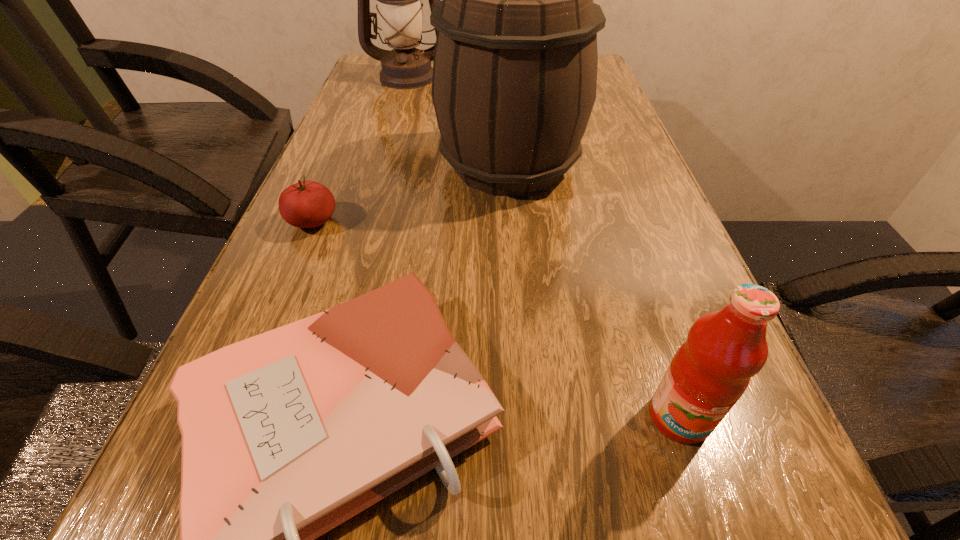
Find the location of a particular element. Image resolution: width=960 pixels, height=540 pixels. tomato that is at the left edge is located at coordinates (306, 204).

Image resolution: width=960 pixels, height=540 pixels. Identify the location of wine bucket present at the right edge. (514, 82).

The width and height of the screenshot is (960, 540). Find the location of `fruit juice that is at the right edge`. fruit juice that is at the right edge is located at coordinates tap(709, 373).

Locate an element on the screen. This screenshot has height=540, width=960. object that is at the far left corner is located at coordinates (399, 8).

In order to click on vacant space at the left edge of the desktop in this screenshot , I will do pos(334,141).

Locate an element on the screen. This screenshot has height=540, width=960. free space at the right edge of the desktop is located at coordinates (738, 450).

The image size is (960, 540). In order to click on free area in between the farthest object and the tomato in this screenshot , I will do `click(361, 149)`.

The image size is (960, 540). In order to click on vacant space that's between the tomato and the wine bucket in this screenshot , I will do `click(411, 193)`.

Locate an element on the screen. This screenshot has width=960, height=540. vacant area that lies between the wine bucket and the fruit juice is located at coordinates (594, 291).

Identify which object is located as the second nearest to the third tallest object. Please provide its 2D coordinates. Your answer should be formatted as a tuple, i.e. [(x, y)], where the tuple contains the x and y coordinates of a point satisfying the conditions above.

[(514, 82)]